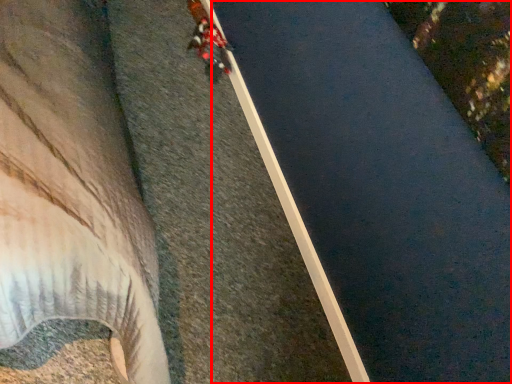
Question: From the image's perspective, where is waterway (annotated by the red box) located relative to person?

Choices:
 (A) above
 (B) below

Answer: (B)